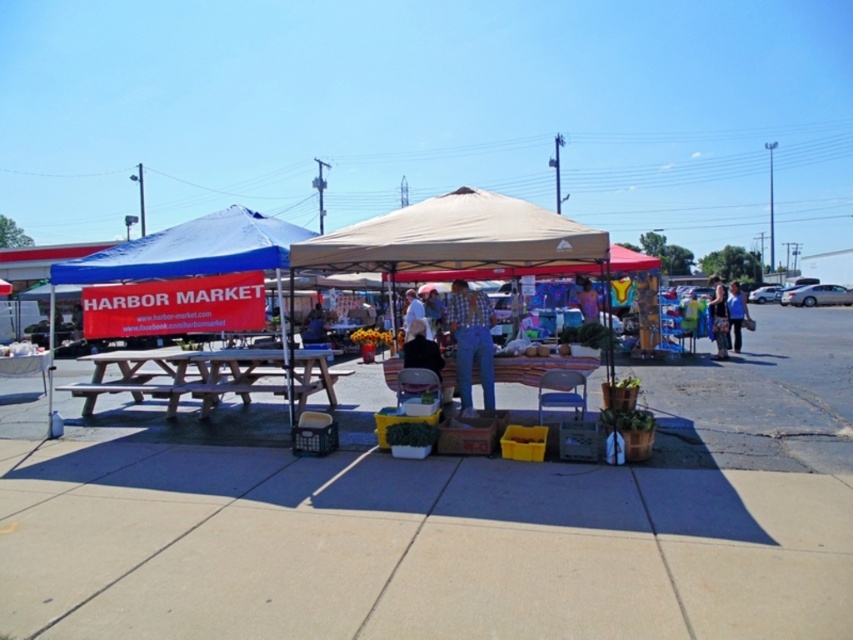
The height and width of the screenshot is (640, 853). In order to click on tan fabric canopy at center in this screenshot , I will do `click(456, 241)`.

Does tan fabric canopy at center lie behind blue fabric bag at lower right?

That is False.

Is point (372, 228) positioned in front of point (741, 323)?

Yes, point (372, 228) is closer to viewer.

The width and height of the screenshot is (853, 640). What are the coordinates of `tan fabric canopy at center` in the screenshot? It's located at (456, 241).

Can you confirm if checkered fabric shirt at center is positioned to the left of denim jacket at lower right?

Yes, checkered fabric shirt at center is to the left of denim jacket at lower right.

Where is `checkered fabric shirt at center`? The image size is (853, 640). checkered fabric shirt at center is located at coordinates (471, 340).

Image resolution: width=853 pixels, height=640 pixels. Find the location of `checkered fabric shirt at center`. checkered fabric shirt at center is located at coordinates (x=471, y=340).

Consider the image. Does purple fabric umbrella at center appear on the left side of white fabric umbrella at center?

No, purple fabric umbrella at center is not to the left of white fabric umbrella at center.

This screenshot has width=853, height=640. Describe the element at coordinates (587, 301) in the screenshot. I see `purple fabric umbrella at center` at that location.

At what (x,y) coordinates should I click in order to perform the action: click on purple fabric umbrella at center. Please return your answer as a coordinate pair (x, y). The image size is (853, 640). Looking at the image, I should click on (587, 301).